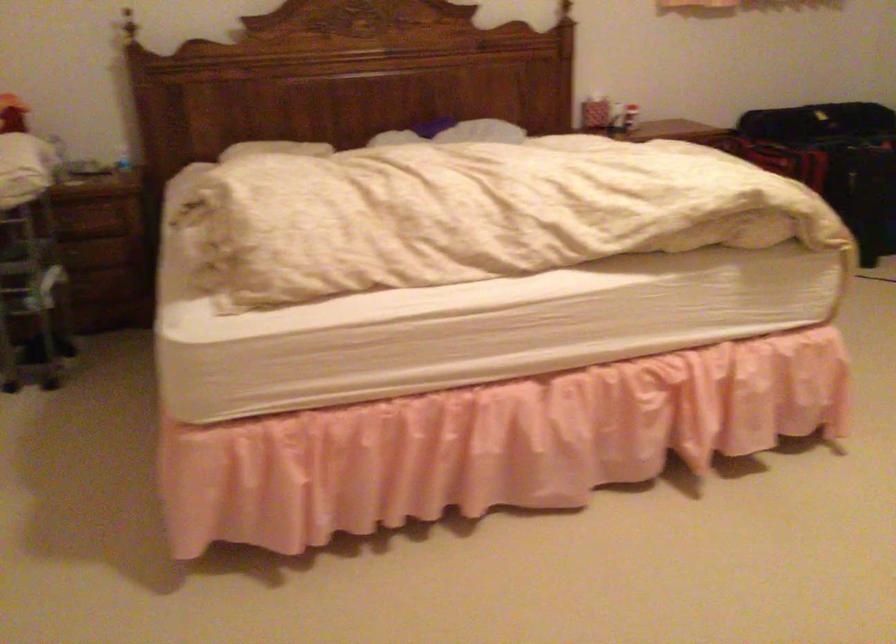
I want to click on red and white box, so click(x=590, y=109).